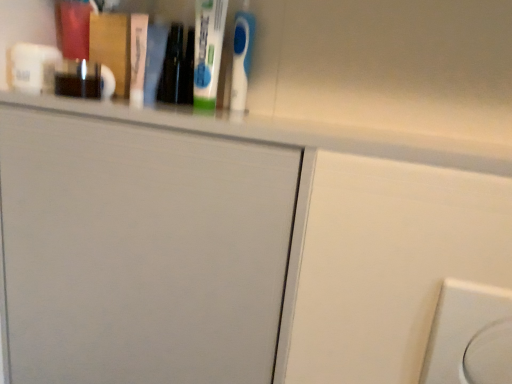
Question: Considering the relative positions of white plastic electric outlet at lower right and white glossy ledge at upper center in the image provided, is white plastic electric outlet at lower right in front of white glossy ledge at upper center?

Choices:
 (A) yes
 (B) no

Answer: (A)

Question: Is white plastic electric outlet at lower right oriented away from white glossy ledge at upper center?

Choices:
 (A) yes
 (B) no

Answer: (B)

Question: Considering the relative sizes of white plastic electric outlet at lower right and white glossy ledge at upper center in the image provided, is white plastic electric outlet at lower right shorter than white glossy ledge at upper center?

Choices:
 (A) no
 (B) yes

Answer: (A)

Question: Is white plastic electric outlet at lower right aimed at white glossy ledge at upper center?

Choices:
 (A) yes
 (B) no

Answer: (B)

Question: Is white plastic electric outlet at lower right wider than white glossy ledge at upper center?

Choices:
 (A) yes
 (B) no

Answer: (B)

Question: Can you see white plastic electric outlet at lower right touching white glossy ledge at upper center?

Choices:
 (A) no
 (B) yes

Answer: (A)

Question: Could you tell me if white plastic electric outlet at lower right is turned towards white matte door at upper center?

Choices:
 (A) no
 (B) yes

Answer: (A)

Question: Considering the relative sizes of white plastic electric outlet at lower right and white matte door at upper center in the image provided, is white plastic electric outlet at lower right bigger than white matte door at upper center?

Choices:
 (A) yes
 (B) no

Answer: (B)

Question: Is white plastic electric outlet at lower right beside white matte door at upper center?

Choices:
 (A) no
 (B) yes

Answer: (A)

Question: Can you confirm if white plastic electric outlet at lower right is thinner than white matte door at upper center?

Choices:
 (A) no
 (B) yes

Answer: (B)

Question: From the image's perspective, would you say white plastic electric outlet at lower right is positioned over white matte door at upper center?

Choices:
 (A) yes
 (B) no

Answer: (B)

Question: Is white plastic electric outlet at lower right located outside white matte door at upper center?

Choices:
 (A) no
 (B) yes

Answer: (B)

Question: Is white matte door at upper center wider than white glossy ledge at upper center?

Choices:
 (A) no
 (B) yes

Answer: (A)